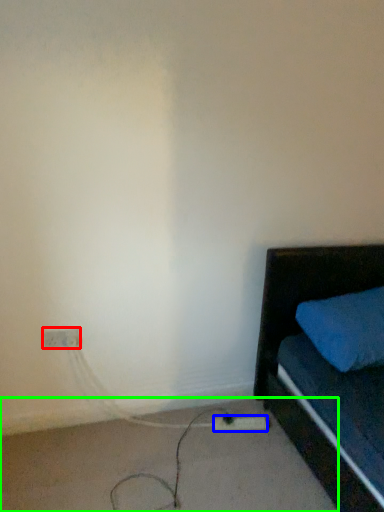
Question: Which object is the farthest from electric outlet (highlighted by a red box)? Choose among these: extension cord (highlighted by a blue box) or concrete (highlighted by a green box).

Choices:
 (A) extension cord
 (B) concrete

Answer: (A)